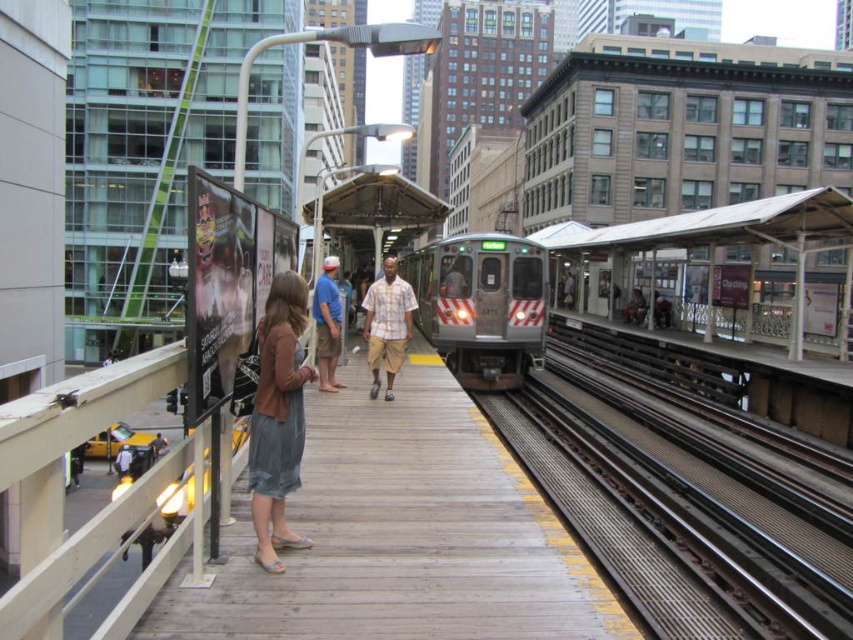
Question: Which object appears closest to the camera in this image?

Choices:
 (A) denim skirt at center
 (B) blue cotton shirt at center
 (C) plaid cotton shirt at center
 (D) silver metallic train at center

Answer: (A)

Question: Can you confirm if denim skirt at center is thinner than blue cotton shirt at center?

Choices:
 (A) no
 (B) yes

Answer: (B)

Question: Observing the image, what is the correct spatial positioning of metal/textured train track at right in reference to silver metallic train at center?

Choices:
 (A) above
 (B) below

Answer: (B)

Question: Estimate the real-world distances between objects in this image. Which object is farther from the blue cotton shirt at center?

Choices:
 (A) metal/textured train track at right
 (B) silver metallic train at center
 (C) denim skirt at center
 (D) plaid cotton shirt at center

Answer: (B)

Question: Which of the following is the farthest from the observer?

Choices:
 (A) (387, 342)
 (B) (339, 312)
 (C) (573, 417)

Answer: (C)

Question: Does denim skirt at center have a larger size compared to blue cotton shirt at center?

Choices:
 (A) no
 (B) yes

Answer: (A)